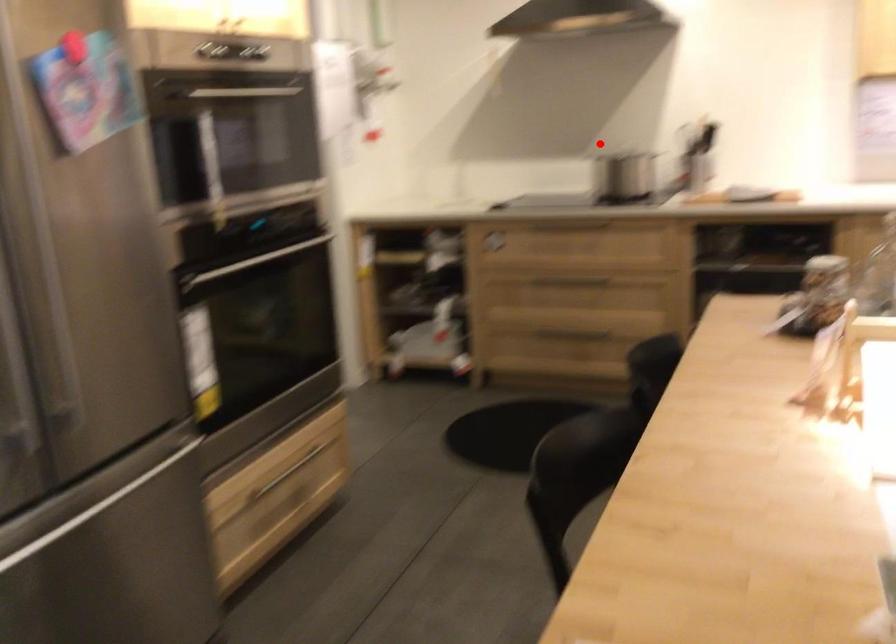
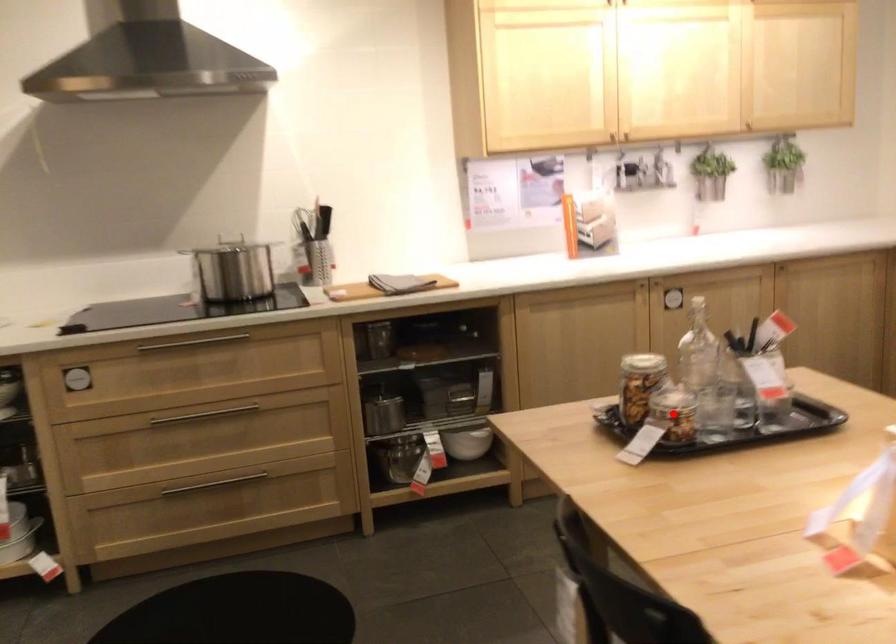
I am providing you with two images of the same scene from different viewpoints. A red point is marked on the first image and another point is marked on the second image. Is the red point in image1 aligned with the point shown in image2?

No